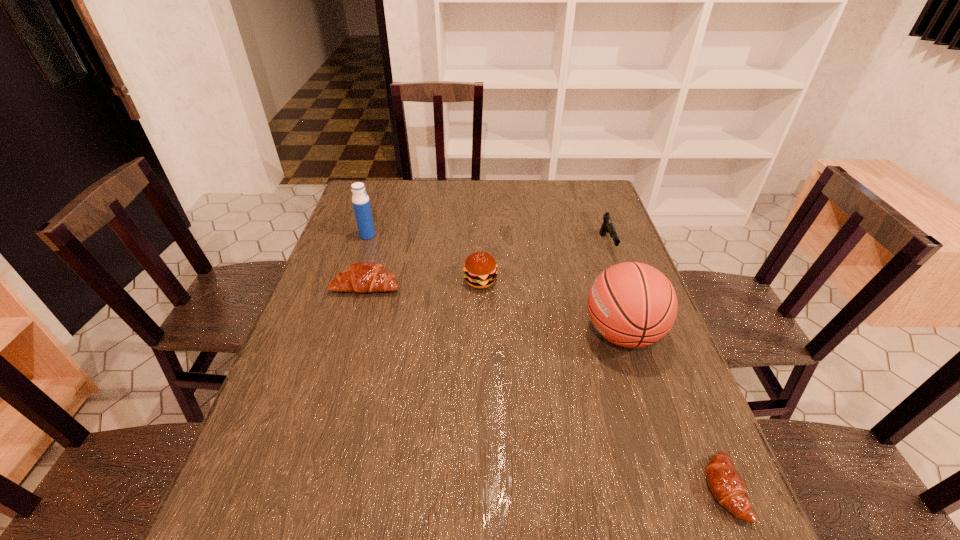
This screenshot has width=960, height=540. Find the location of `free region located 0.240m at the aiming end of the gun`. free region located 0.240m at the aiming end of the gun is located at coordinates (634, 321).

The image size is (960, 540). In order to click on free location located on the back of the hamburger in this screenshot , I will do `click(481, 255)`.

The height and width of the screenshot is (540, 960). Identify the location of vacant space located 0.180m on the back of the water bottle. (378, 202).

This screenshot has height=540, width=960. In order to click on free space located 0.060m on the logo side of the second nearest object in this screenshot , I will do `click(559, 333)`.

Identify the location of free location located 0.060m on the logo side of the second nearest object. (559, 333).

I want to click on vacant area located on the logo side of the second nearest object, so click(x=492, y=333).

Where is `object that is at the near edge`? This screenshot has height=540, width=960. object that is at the near edge is located at coordinates (727, 486).

This screenshot has width=960, height=540. I want to click on crescent roll that is positioned at the left edge, so click(x=363, y=277).

You are a GUI agent. You are given a task and a screenshot of the screen. Output one action in this format:
    pyautogui.click(x=<x>, y=<y>)
    Task: Click on the water bottle at the left edge
    Image resolution: width=960 pixels, height=540 pixels.
    Given the screenshot: What is the action you would take?
    pyautogui.click(x=360, y=200)

This screenshot has height=540, width=960. Find the location of `crescent roll that is at the right edge`. crescent roll that is at the right edge is located at coordinates (727, 486).